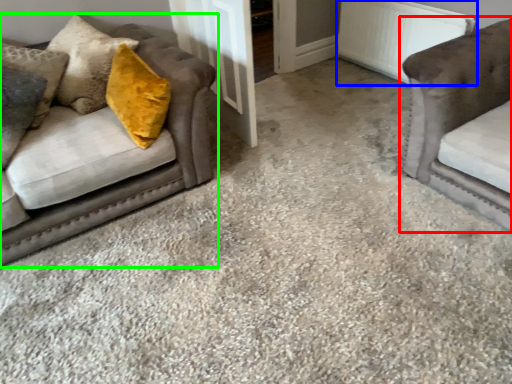
Question: Based on their relative distances, which object is nearer to studio couch (highlighted by a red box)? Choose from radiator (highlighted by a blue box) and studio couch (highlighted by a green box).

Choices:
 (A) radiator
 (B) studio couch

Answer: (A)